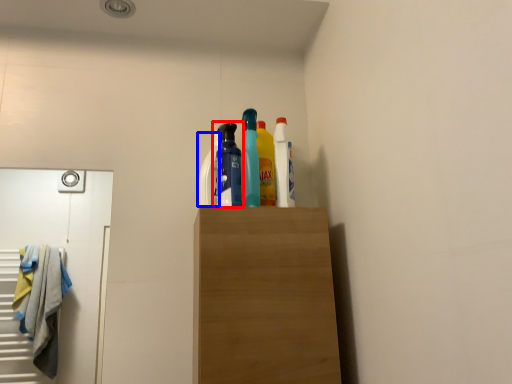
Question: Among these objects, which one is farthest to the camera, bottle (highlighted by a red box) or cleaning product (highlighted by a blue box)?

Choices:
 (A) bottle
 (B) cleaning product

Answer: (B)